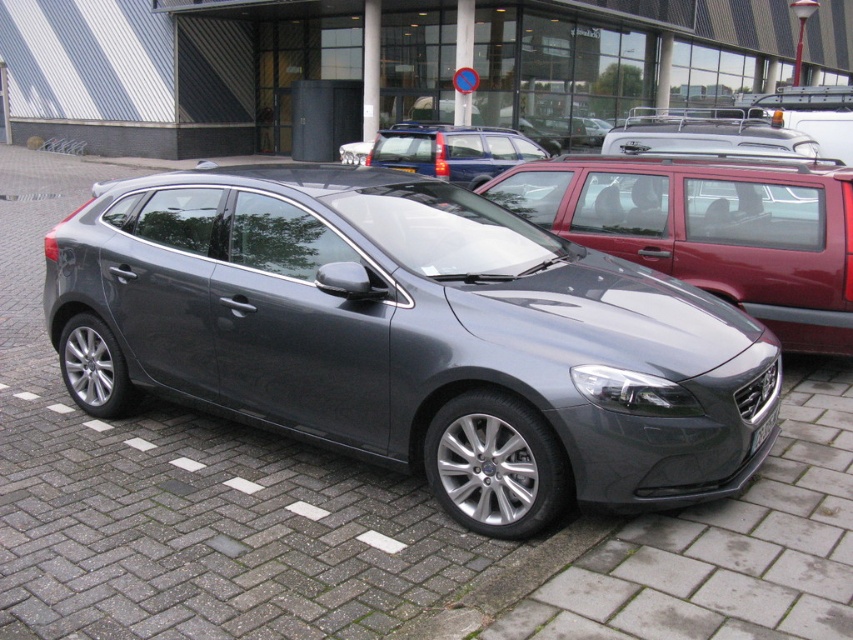
Identify the location of satin metallic hatchback at center. This screenshot has height=640, width=853. point(410,337).

Is the position of satin metallic hatchback at center more distant than that of metallic red minivan at center?

No, satin metallic hatchback at center is in front of metallic red minivan at center.

Measure the distance between satin metallic hatchback at center and camera.

satin metallic hatchback at center is 3.17 meters from camera.

This screenshot has width=853, height=640. What are the coordinates of `satin metallic hatchback at center` in the screenshot? It's located at (410, 337).

Between satin metallic hatchback at center and white plastic license plate at center, which one is positioned higher?

white plastic license plate at center

What do you see at coordinates (410, 337) in the screenshot? Image resolution: width=853 pixels, height=640 pixels. I see `satin metallic hatchback at center` at bounding box center [410, 337].

Is point (302, 413) less distant than point (764, 429)?

That is False.

Image resolution: width=853 pixels, height=640 pixels. Identify the location of satin metallic hatchback at center. (x=410, y=337).

Which is behind, point (454, 154) or point (756, 444)?

Positioned behind is point (454, 154).

Is point (366, 157) closer to viewer compared to point (750, 449)?

No, (366, 157) is further to viewer.

This screenshot has width=853, height=640. I want to click on satin blue car at center, so click(451, 150).